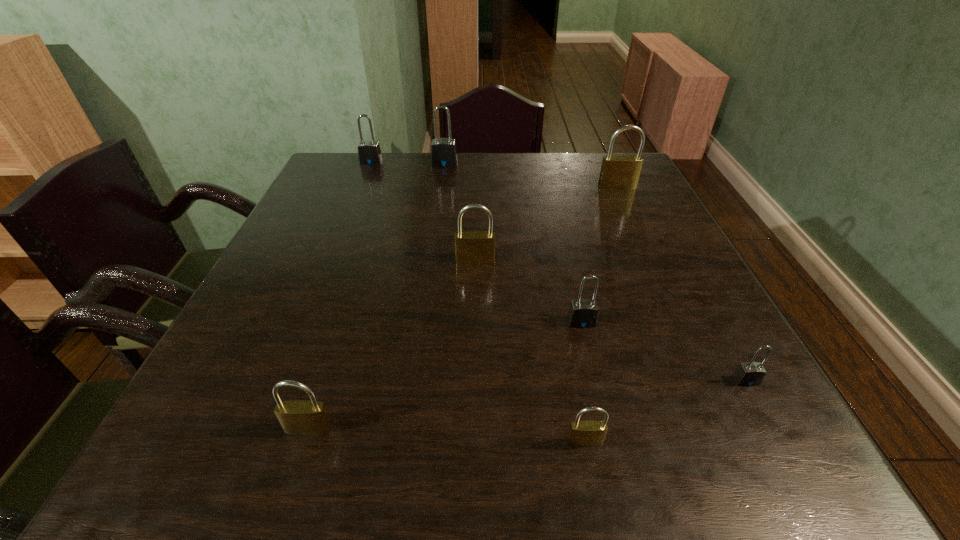
I want to click on unoccupied area between the fourth farthest padlock and the third biggest gray padlock, so [x=528, y=292].

This screenshot has width=960, height=540. Find the location of `free spot between the farthest brass padlock and the second brass padlock from left to right`. free spot between the farthest brass padlock and the second brass padlock from left to right is located at coordinates (546, 224).

You are a GUI agent. You are given a task and a screenshot of the screen. Output one action in this format:
    pyautogui.click(x=<x>, y=<y>)
    Task: Click on the free area in between the second biggest brass padlock and the sixth farthest padlock
    This screenshot has width=960, height=540.
    Given the screenshot: What is the action you would take?
    pyautogui.click(x=611, y=321)

You are a GUI agent. You are given a task and a screenshot of the screen. Output one action in this format:
    pyautogui.click(x=<x>, y=<y>)
    Task: Click on the unoccupied position between the fourth farthest object and the third farthest padlock
    
    Given the screenshot: What is the action you would take?
    pyautogui.click(x=546, y=224)

You are a GUI agent. You are given a task and a screenshot of the screen. Output one action in this format:
    pyautogui.click(x=<x>, y=<y>)
    Task: Click on the vacant space in between the nearest object and the second smallest brass padlock
    
    Given the screenshot: What is the action you would take?
    pyautogui.click(x=446, y=435)

The height and width of the screenshot is (540, 960). Find the location of `free spot between the nearest brass padlock and the fifth farthest object`. free spot between the nearest brass padlock and the fifth farthest object is located at coordinates (583, 382).

Where is `free space between the sixth farthest padlock and the rightmost brass padlock`? free space between the sixth farthest padlock and the rightmost brass padlock is located at coordinates (682, 284).

You are a GUI agent. You are given a task and a screenshot of the screen. Output one action in this format:
    pyautogui.click(x=<x>, y=<y>)
    Task: Click on the vacant space that's between the third nearest object and the nearest padlock
    
    Given the screenshot: What is the action you would take?
    pyautogui.click(x=665, y=411)

Where is `free spot between the third nearest object and the second brass padlock from right to left`? free spot between the third nearest object and the second brass padlock from right to left is located at coordinates (665, 411).

The width and height of the screenshot is (960, 540). Identify the location of the fifth closest object to the third padlock from left to right. (301, 417).